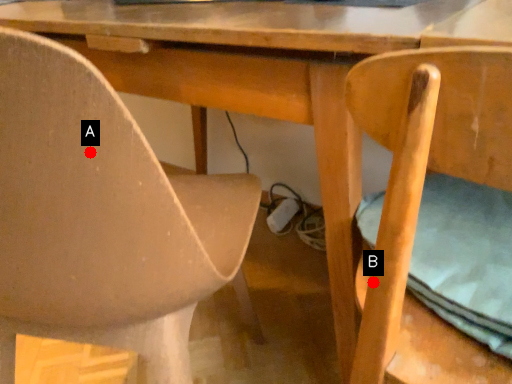
Question: Two points are circled on the image, labeled by A and B beside each circle. Which point is closer to the camera taking this photo?

Choices:
 (A) A is closer
 (B) B is closer

Answer: (A)